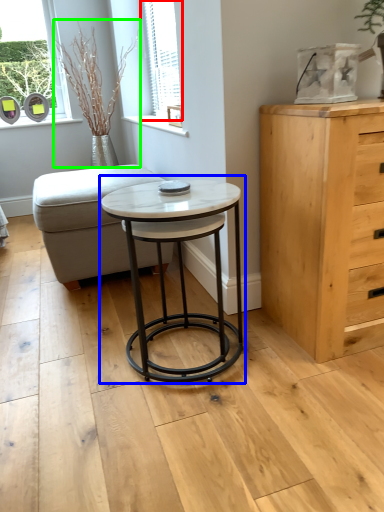
Question: Which is nearer to the window (highlighted by a red box)? coffee table (highlighted by a blue box) or plant (highlighted by a green box).

Choices:
 (A) coffee table
 (B) plant

Answer: (B)